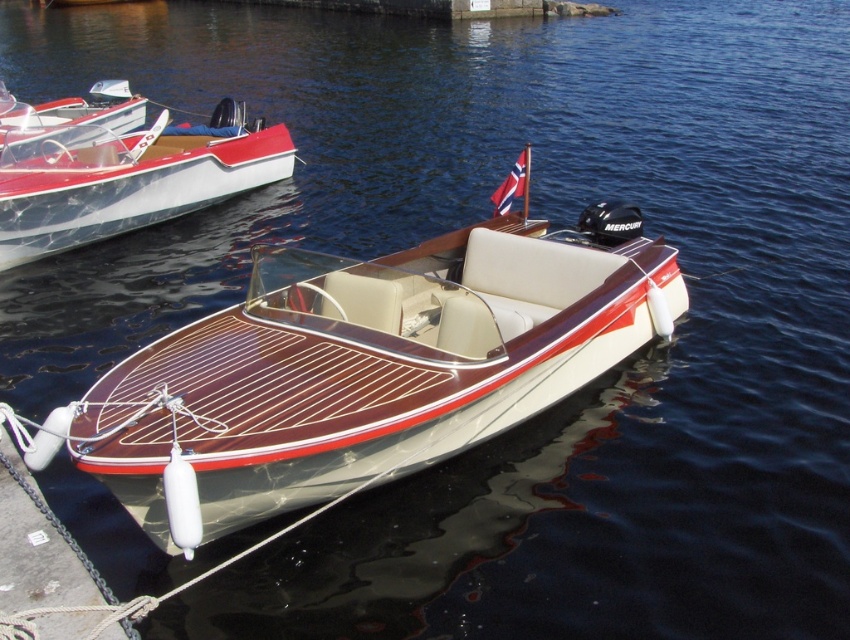
Question: Estimate the real-world distances between objects in this image. Which object is farther from the shiny white boat at left?

Choices:
 (A) shiny metallic boat at upper left
 (B) wooden boat at center

Answer: (A)

Question: Which point appears closest to the camera in this image?

Choices:
 (A) (145, 132)
 (B) (230, 435)

Answer: (B)

Question: Does wooden boat at center have a larger size compared to shiny metallic boat at upper left?

Choices:
 (A) yes
 (B) no

Answer: (A)

Question: Which of the following is the closest to the observer?

Choices:
 (A) (109, 116)
 (B) (10, 211)
 (C) (162, 356)

Answer: (C)

Question: Observing the image, what is the correct spatial positioning of wooden boat at center in reference to shiny white boat at left?

Choices:
 (A) right
 (B) left

Answer: (A)

Question: Is wooden boat at center positioned in front of shiny metallic boat at upper left?

Choices:
 (A) no
 (B) yes

Answer: (B)